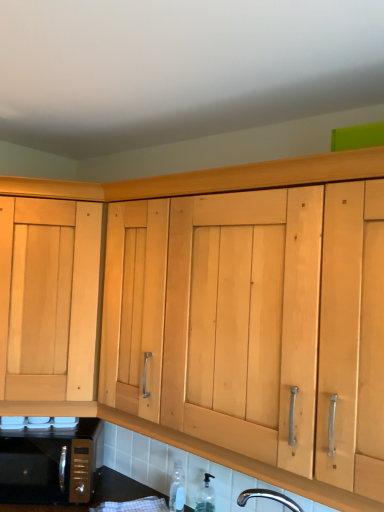
The image size is (384, 512). What do you see at coordinates (50, 463) in the screenshot?
I see `black metallic microwave at lower left` at bounding box center [50, 463].

Identify the location of clear glass bottle at lower center, marked as the second bottle in a left-to-right arrangement. The image size is (384, 512). (206, 496).

Does point (178, 474) come behind point (208, 486)?

Yes, point (178, 474) is farther from viewer.

Which of these two, transparent plastic bottle at lower center, acting as the second bottle starting from the right, or clear glass bottle at lower center, which appears as the first bottle when viewed from the right, is thinner?

With smaller width is clear glass bottle at lower center, which appears as the first bottle when viewed from the right.

From a real-world perspective, is transparent plastic bottle at lower center, which is the 1th bottle from left to right, above or below clear glass bottle at lower center, marked as the second bottle in a left-to-right arrangement?

Clearly, from a real-world perspective, transparent plastic bottle at lower center, which is the 1th bottle from left to right, is above clear glass bottle at lower center, marked as the second bottle in a left-to-right arrangement.

Is transparent plastic bottle at lower center, which is the 1th bottle from left to right, not inside clear glass bottle at lower center, marked as the second bottle in a left-to-right arrangement?

transparent plastic bottle at lower center, which is the 1th bottle from left to right, lies outside clear glass bottle at lower center, marked as the second bottle in a left-to-right arrangement,'s area.

Does clear glass bottle at lower center, marked as the second bottle in a left-to-right arrangement, turn towards light wood cabinet at left?

No, clear glass bottle at lower center, marked as the second bottle in a left-to-right arrangement, is not aimed at light wood cabinet at left.

Is clear glass bottle at lower center, which appears as the first bottle when viewed from the right, not near light wood cabinet at left?

That's not correct — clear glass bottle at lower center, which appears as the first bottle when viewed from the right, is a little close to light wood cabinet at left.

Is point (200, 490) positioned before point (29, 233)?

No, (200, 490) is further to viewer.

Considering the positions of objects clear glass bottle at lower center, marked as the second bottle in a left-to-right arrangement, and transparent plastic bottle at lower center, acting as the second bottle starting from the right, in the image provided, who is in front, clear glass bottle at lower center, marked as the second bottle in a left-to-right arrangement, or transparent plastic bottle at lower center, acting as the second bottle starting from the right,?

Positioned in front is clear glass bottle at lower center, marked as the second bottle in a left-to-right arrangement.

Can you confirm if clear glass bottle at lower center, marked as the second bottle in a left-to-right arrangement, is wider than transparent plastic bottle at lower center, acting as the second bottle starting from the right?

No, clear glass bottle at lower center, marked as the second bottle in a left-to-right arrangement, is not wider than transparent plastic bottle at lower center, acting as the second bottle starting from the right.

From a real-world perspective, which object rests below the other?

clear glass bottle at lower center, marked as the second bottle in a left-to-right arrangement, from a real-world perspective.

Based on the photo, can you confirm if clear glass bottle at lower center, which appears as the first bottle when viewed from the right, is shorter than black metallic microwave at lower left?

Indeed, clear glass bottle at lower center, which appears as the first bottle when viewed from the right, has a lesser height compared to black metallic microwave at lower left.

Considering the sizes of objects clear glass bottle at lower center, which appears as the first bottle when viewed from the right, and black metallic microwave at lower left in the image provided, who is bigger, clear glass bottle at lower center, which appears as the first bottle when viewed from the right, or black metallic microwave at lower left?

black metallic microwave at lower left.

Which object is positioned more to the left, clear glass bottle at lower center, which appears as the first bottle when viewed from the right, or black metallic microwave at lower left?

From the viewer's perspective, black metallic microwave at lower left appears more on the left side.

Is clear glass bottle at lower center, which appears as the first bottle when viewed from the right, further to camera compared to black metallic microwave at lower left?

No, it is in front of black metallic microwave at lower left.

In terms of width, does light wood cabinet at left look wider or thinner when compared to transparent plastic bottle at lower center, acting as the second bottle starting from the right?

Considering their sizes, light wood cabinet at left looks broader than transparent plastic bottle at lower center, acting as the second bottle starting from the right.

Can transparent plastic bottle at lower center, which is the 1th bottle from left to right, be found inside light wood cabinet at left?

Actually, transparent plastic bottle at lower center, which is the 1th bottle from left to right, is outside light wood cabinet at left.

From a real-world perspective, between light wood cabinet at left and transparent plastic bottle at lower center, which is the 1th bottle from left to right, who is vertically higher?

In real-world perspective, light wood cabinet at left is above.

Which of these two, black metallic microwave at lower left or transparent plastic bottle at lower center, which is the 1th bottle from left to right, is wider?

Wider between the two is black metallic microwave at lower left.

Does black metallic microwave at lower left lie behind transparent plastic bottle at lower center, which is the 1th bottle from left to right?

Yes, black metallic microwave at lower left is behind transparent plastic bottle at lower center, which is the 1th bottle from left to right.

Is black metallic microwave at lower left in contact with transparent plastic bottle at lower center, which is the 1th bottle from left to right?

No, black metallic microwave at lower left is not in contact with transparent plastic bottle at lower center, which is the 1th bottle from left to right.

Who is bigger, black metallic microwave at lower left or transparent plastic bottle at lower center, which is the 1th bottle from left to right?

black metallic microwave at lower left is bigger.

Considering the relative positions of light wood cabinet at left and clear glass bottle at lower center, marked as the second bottle in a left-to-right arrangement, in the image provided, is light wood cabinet at left to the left of clear glass bottle at lower center, marked as the second bottle in a left-to-right arrangement, from the viewer's perspective?

Yes, light wood cabinet at left is to the left of clear glass bottle at lower center, marked as the second bottle in a left-to-right arrangement.

Is light wood cabinet at left next to clear glass bottle at lower center, marked as the second bottle in a left-to-right arrangement?

No, light wood cabinet at left is not next to clear glass bottle at lower center, marked as the second bottle in a left-to-right arrangement.

Between light wood cabinet at left and clear glass bottle at lower center, marked as the second bottle in a left-to-right arrangement, which one has smaller width?

With smaller width is clear glass bottle at lower center, marked as the second bottle in a left-to-right arrangement.

Which point is more distant from viewer, (44, 217) or (210, 490)?

The point (210, 490) is behind.

You are a GUI agent. You are given a task and a screenshot of the screen. Output one action in this format:
    pyautogui.click(x=<x>, y=<y>)
    Task: Click on the bottle below the transparent plastic bottle at lower center, acting as the second bottle starting from the right (from the image's perspective)
    The height and width of the screenshot is (512, 384).
    Given the screenshot: What is the action you would take?
    pyautogui.click(x=206, y=496)

You are a GUI agent. You are given a task and a screenshot of the screen. Output one action in this format:
    pyautogui.click(x=<x>, y=<y>)
    Task: Click on the cabinetry above the clear glass bottle at lower center, which appears as the first bottle when viewed from the right (from a real-world perspective)
    
    Given the screenshot: What is the action you would take?
    pyautogui.click(x=50, y=298)

From the image, which object appears to be nearer to transparent plastic bottle at lower center, acting as the second bottle starting from the right, black metallic microwave at lower left or clear glass bottle at lower center, which appears as the first bottle when viewed from the right?

clear glass bottle at lower center, which appears as the first bottle when viewed from the right, lies closer to transparent plastic bottle at lower center, acting as the second bottle starting from the right, than the other object.

Based on their spatial positions, is black metallic microwave at lower left or light wood cabinet at left closer to clear glass bottle at lower center, marked as the second bottle in a left-to-right arrangement?

black metallic microwave at lower left is positioned closer to the anchor clear glass bottle at lower center, marked as the second bottle in a left-to-right arrangement.

Considering their positions, is clear glass bottle at lower center, marked as the second bottle in a left-to-right arrangement, positioned closer to transparent plastic bottle at lower center, acting as the second bottle starting from the right, than black metallic microwave at lower left?

clear glass bottle at lower center, marked as the second bottle in a left-to-right arrangement.

Based on their spatial positions, is black metallic microwave at lower left or transparent plastic bottle at lower center, acting as the second bottle starting from the right, further from clear glass bottle at lower center, marked as the second bottle in a left-to-right arrangement?

The object further to clear glass bottle at lower center, marked as the second bottle in a left-to-right arrangement, is black metallic microwave at lower left.

Considering their positions, is clear glass bottle at lower center, which appears as the first bottle when viewed from the right, positioned closer to transparent plastic bottle at lower center, acting as the second bottle starting from the right, than light wood cabinet at left?

clear glass bottle at lower center, which appears as the first bottle when viewed from the right, is positioned closer to the anchor transparent plastic bottle at lower center, acting as the second bottle starting from the right.

From the image, which object appears to be farther from light wood cabinet at left, clear glass bottle at lower center, marked as the second bottle in a left-to-right arrangement, or black metallic microwave at lower left?

The object further to light wood cabinet at left is clear glass bottle at lower center, marked as the second bottle in a left-to-right arrangement.

Estimate the real-world distances between objects in this image. Which object is closer to black metallic microwave at lower left, transparent plastic bottle at lower center, acting as the second bottle starting from the right, or clear glass bottle at lower center, marked as the second bottle in a left-to-right arrangement?

Based on the image, transparent plastic bottle at lower center, acting as the second bottle starting from the right, appears to be nearer to black metallic microwave at lower left.

Considering their positions, is black metallic microwave at lower left positioned further to transparent plastic bottle at lower center, which is the 1th bottle from left to right, than light wood cabinet at left?

light wood cabinet at left.

At what (x,y) coordinates should I click in order to perform the action: click on bottle that lies between light wood cabinet at left and clear glass bottle at lower center, marked as the second bottle in a left-to-right arrangement, from top to bottom. Please return your answer as a coordinate pair (x, y). Image resolution: width=384 pixels, height=512 pixels. Looking at the image, I should click on (177, 489).

Where is `bottle between black metallic microwave at lower left and clear glass bottle at lower center, which appears as the first bottle when viewed from the right`? This screenshot has width=384, height=512. bottle between black metallic microwave at lower left and clear glass bottle at lower center, which appears as the first bottle when viewed from the right is located at coordinates (177, 489).

Find the location of a particular element. microwave oven between light wood cabinet at left and clear glass bottle at lower center, marked as the second bottle in a left-to-right arrangement, in the vertical direction is located at coordinates (50, 463).

The image size is (384, 512). Find the location of `microwave oven that lies between light wood cabinet at left and transparent plastic bottle at lower center, which is the 1th bottle from left to right, from top to bottom`. microwave oven that lies between light wood cabinet at left and transparent plastic bottle at lower center, which is the 1th bottle from left to right, from top to bottom is located at coordinates (50, 463).